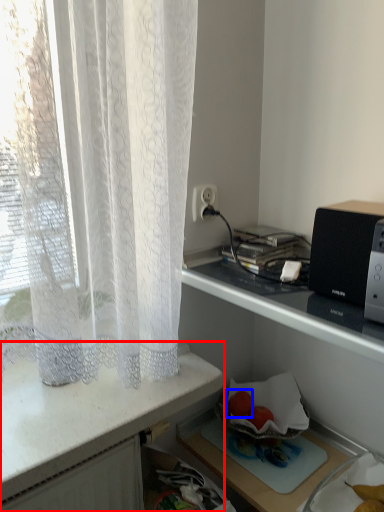
Question: Which of the following is the closest to the observer, desk (highlighted by a red box) or fruit (highlighted by a blue box)?

Choices:
 (A) desk
 (B) fruit

Answer: (A)